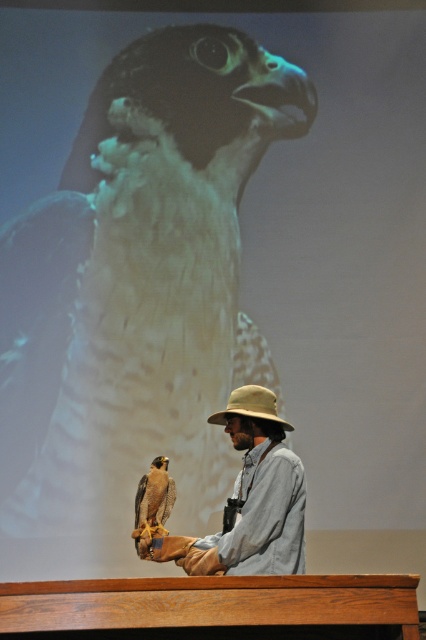
Question: Among these points, which one is nearest to the camera?

Choices:
 (A) (161, 525)
 (B) (221, 417)
 (C) (212, 417)
 (D) (103, 365)

Answer: (A)

Question: Is khaki fabric hat at center to the left of tan fabric hat at center from the viewer's perspective?

Choices:
 (A) yes
 (B) no

Answer: (A)

Question: Which point appears farthest from the camera in this image?

Choices:
 (A) coord(166,545)
 (B) coord(163,324)
 (C) coord(158,465)
 (D) coord(276,419)

Answer: (B)

Question: Is brown feathered falcon at center wider than brown feathered falcon at lower left?

Choices:
 (A) yes
 (B) no

Answer: (A)

Question: Is khaki fabric hat at center positioned before brown feathered falcon at lower left?

Choices:
 (A) yes
 (B) no

Answer: (A)

Question: Among these objects, which one is nearest to the camera?

Choices:
 (A) brown feathered falcon at center
 (B) tan fabric hat at center
 (C) khaki fabric hat at center
 (D) brown feathered falcon at lower left

Answer: (C)